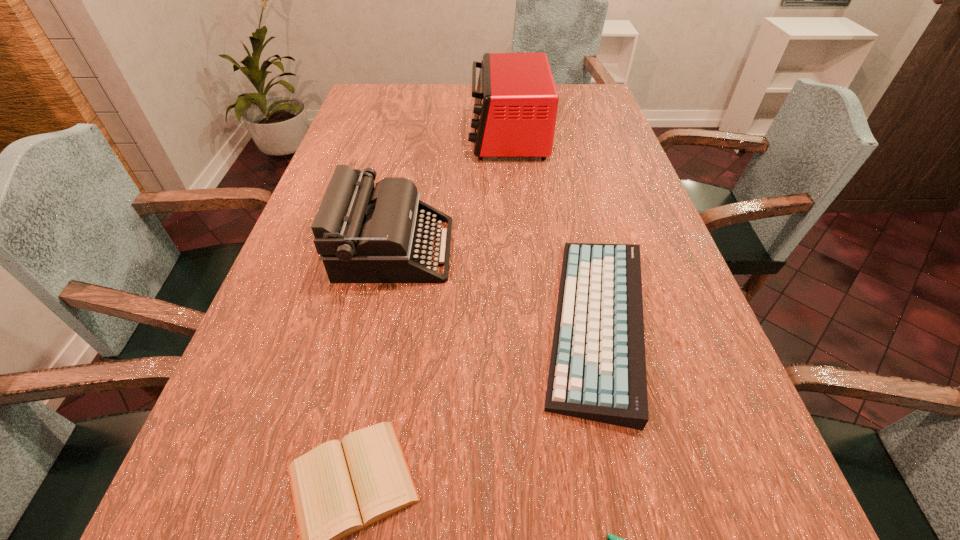
At what (x,y) coordinates should I click in order to perform the action: click on the fourth closest object relative to the pliers. Please return your answer as a coordinate pair (x, y). The height and width of the screenshot is (540, 960). Looking at the image, I should click on [516, 101].

Where is `object that stands as the closest to the diary`? object that stands as the closest to the diary is located at coordinates (597, 372).

You are a GUI agent. You are given a task and a screenshot of the screen. Output one action in this format:
    pyautogui.click(x=<x>, y=<y>)
    Task: Click on the vacant space that satisfies the following two spatial constraints: 1. on the back side of the computer keyboard; 2. on the typing side of the typewriter
    
    Given the screenshot: What is the action you would take?
    pyautogui.click(x=580, y=249)

The height and width of the screenshot is (540, 960). In order to click on vacant area that satisfies the following two spatial constraints: 1. on the back side of the third shortest object; 2. on the front-facing side of the toaster oven in this screenshot , I will do tap(553, 136).

Image resolution: width=960 pixels, height=540 pixels. Identify the location of blank space that satisfies the following two spatial constraints: 1. on the back side of the computer keyboard; 2. on the front-facing side of the farthest object. (553, 136).

This screenshot has width=960, height=540. Find the location of `vacant point that satisfies the following two spatial constraints: 1. on the front-facing side of the toaster oven; 2. on the left side of the third tallest object`. vacant point that satisfies the following two spatial constraints: 1. on the front-facing side of the toaster oven; 2. on the left side of the third tallest object is located at coordinates (523, 322).

This screenshot has height=540, width=960. Identify the location of vacant space that satisfies the following two spatial constraints: 1. on the typing side of the third tallest object; 2. on the right side of the typewriter. (380, 322).